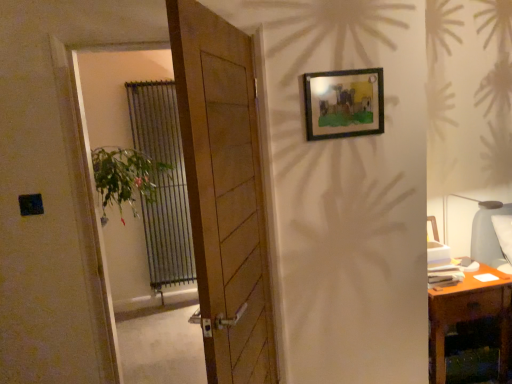
Question: Is wooden frame at upper right taller or shorter than wooden door at center?

Choices:
 (A) tall
 (B) short

Answer: (B)

Question: Is wooden frame at upper right to the left or to the right of wooden door at center in the image?

Choices:
 (A) left
 (B) right

Answer: (B)

Question: Which of these objects is positioned closest to the green leafy plant at left?

Choices:
 (A) wooden frame at upper right
 (B) wooden desk at right
 (C) matte gray lampshade at right
 (D) wooden door at center
 (E) metallic silver radiator at left

Answer: (D)

Question: Which of these objects is positioned closest to the green leafy plant at left?

Choices:
 (A) metallic silver radiator at left
 (B) wooden desk at right
 (C) matte gray lampshade at right
 (D) wooden door at center
 (E) wooden frame at upper right

Answer: (D)